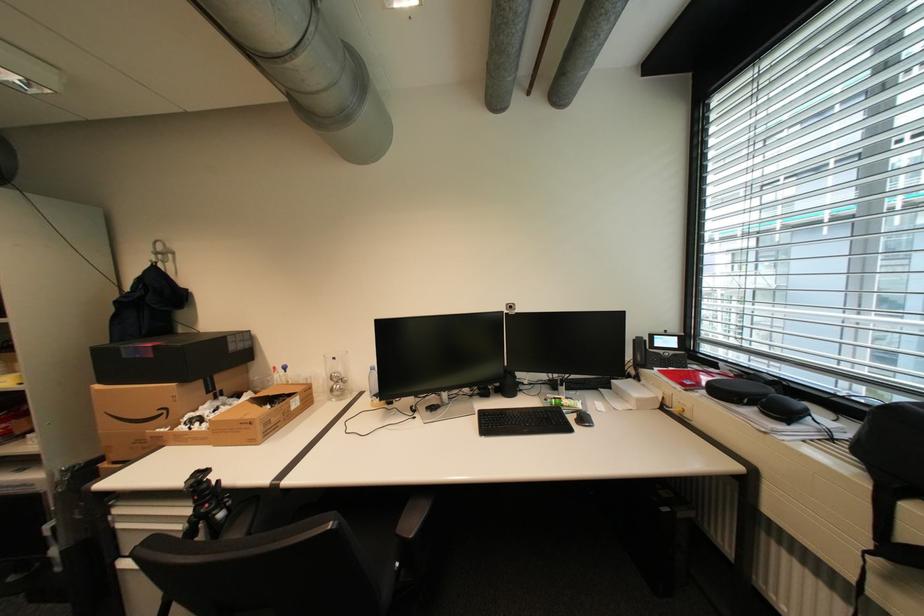
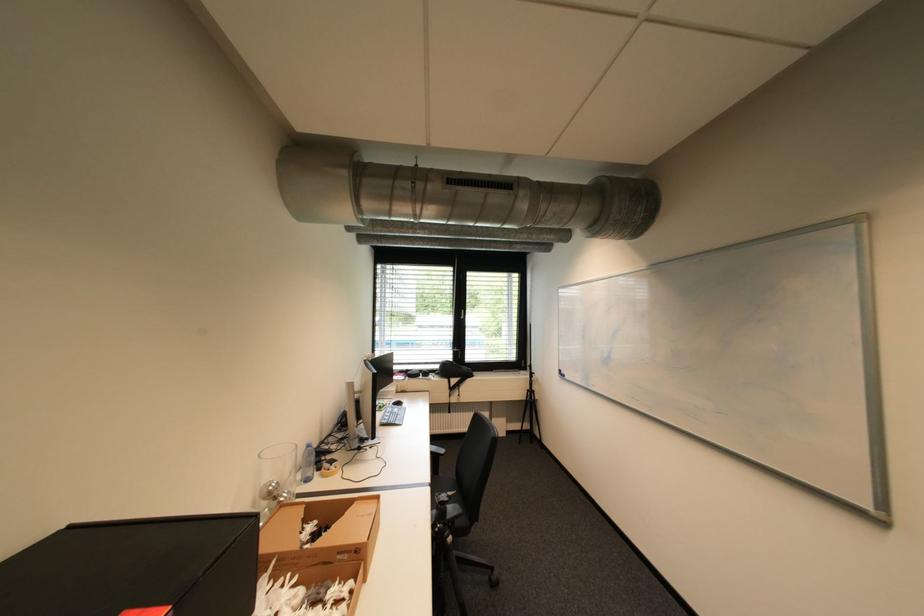
The point at (293, 395) is marked in the first image. Where is the corresponding point in the second image?

(311, 520)